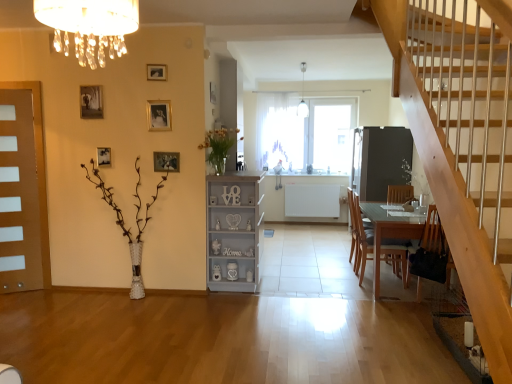
Question: Considering the relative positions of matte black picture frame at left, which is the 2th picture frame in back-to-front order, and translucent glass vase at upper center, placed as the first plant when sorted from right to left, in the image provided, is matte black picture frame at left, which is the 2th picture frame in back-to-front order, in front of translucent glass vase at upper center, placed as the first plant when sorted from right to left,?

Choices:
 (A) yes
 (B) no

Answer: (B)

Question: Does matte black picture frame at left, acting as the second picture frame starting from the left, touch translucent glass vase at upper center, placed as the second plant when sorted from bottom to top?

Choices:
 (A) yes
 (B) no

Answer: (B)

Question: Does matte black picture frame at left, acting as the second picture frame starting from the left, have a greater height compared to translucent glass vase at upper center, placed as the second plant when sorted from bottom to top?

Choices:
 (A) yes
 (B) no

Answer: (B)

Question: Would you say matte black picture frame at left, the fifth picture frame viewed from the right, is a long distance from translucent glass vase at upper center, which is the 1th plant in top-to-bottom order?

Choices:
 (A) yes
 (B) no

Answer: (A)

Question: Does matte black picture frame at left, which is the 2th picture frame in back-to-front order, have a larger size compared to translucent glass vase at upper center, which is the 1th plant in top-to-bottom order?

Choices:
 (A) no
 (B) yes

Answer: (A)

Question: From a real-world perspective, does matte black picture frame at left, acting as the second picture frame starting from the left, sit lower than translucent glass vase at upper center, which is the 1th plant in top-to-bottom order?

Choices:
 (A) no
 (B) yes

Answer: (B)

Question: Does clear glass table at lower right have a greater width compared to gold metallic picture frame at upper center, the fifth picture frame positioned from the back?

Choices:
 (A) yes
 (B) no

Answer: (A)

Question: Can you confirm if clear glass table at lower right is bigger than gold metallic picture frame at upper center, the second picture frame when ordered from front to back?

Choices:
 (A) no
 (B) yes

Answer: (B)

Question: From a real-world perspective, is clear glass table at lower right on top of gold metallic picture frame at upper center, which is the 3th picture frame from right to left?

Choices:
 (A) no
 (B) yes

Answer: (A)

Question: From a real-world perspective, is clear glass table at lower right under gold metallic picture frame at upper center, positioned as the fourth picture frame in left-to-right order?

Choices:
 (A) yes
 (B) no

Answer: (A)

Question: Is clear glass table at lower right oriented away from gold metallic picture frame at upper center, which is the 3th picture frame from right to left?

Choices:
 (A) no
 (B) yes

Answer: (A)

Question: Is clear glass table at lower right closer to the viewer compared to gold metallic picture frame at upper center, the second picture frame when ordered from front to back?

Choices:
 (A) no
 (B) yes

Answer: (B)

Question: Does matte brown door at left have a lesser height compared to matte black picture frame at left, acting as the second picture frame starting from the left?

Choices:
 (A) no
 (B) yes

Answer: (A)